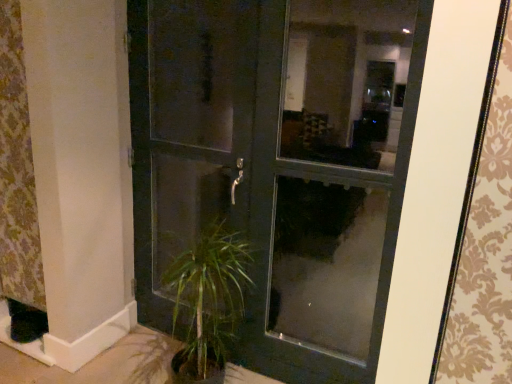
This screenshot has width=512, height=384. Identify the location of matte black screen door at center. (188, 130).

Considering the relative positions of patterned fabric curtain at left and matte black screen door at center in the image provided, is patterned fabric curtain at left in front of matte black screen door at center?

No, patterned fabric curtain at left is further to the viewer.

Is matte black screen door at center at the back of patterned fabric curtain at left?

No.

Which of these two, patterned fabric curtain at left or matte black screen door at center, is smaller?

patterned fabric curtain at left.

Which of these two, matte black screen door at center or patterned fabric curtain at left, is smaller?

patterned fabric curtain at left is smaller.

Is matte black screen door at center not within patterned fabric curtain at left?

matte black screen door at center lies outside patterned fabric curtain at left's area.

Looking at this image, does matte black screen door at center appear on the left side of patterned fabric curtain at left?

Incorrect, matte black screen door at center is not on the left side of patterned fabric curtain at left.

Considering the sizes of objects patterned fabric curtain at left and matte black door at center in the image provided, who is wider, patterned fabric curtain at left or matte black door at center?

matte black door at center is wider.

Considering the sizes of objects patterned fabric curtain at left and matte black door at center in the image provided, who is bigger, patterned fabric curtain at left or matte black door at center?

Bigger between the two is matte black door at center.

I want to click on curtain that is above the matte black door at center (from a real-world perspective), so click(x=17, y=171).

Is point (20, 43) closer or farther from the camera than point (302, 143)?

Point (20, 43) is positioned farther from the camera compared to point (302, 143).

Between matte black door at center and patterned fabric curtain at left, which one appears on the right side from the viewer's perspective?

Positioned to the right is matte black door at center.

From the image's perspective, is matte black door at center located above or below patterned fabric curtain at left?

Clearly, from the image's perspective, matte black door at center is below patterned fabric curtain at left.

From a real-world perspective, is matte black door at center located beneath patterned fabric curtain at left?

Yes.

Can you confirm if matte black door at center is thinner than patterned fabric curtain at left?

No, matte black door at center is not thinner than patterned fabric curtain at left.

Is matte black door at center further to camera compared to matte black screen door at center?

That is False.

In the scene shown: Between matte black door at center and matte black screen door at center, which one appears on the left side from the viewer's perspective?

matte black screen door at center.

Looking at this image, from a real-world perspective, is matte black door at center located higher than matte black screen door at center?

Incorrect, from a real-world perspective, matte black door at center is lower than matte black screen door at center.

Does matte black door at center have a smaller size compared to matte black screen door at center?

Actually, matte black door at center might be larger than matte black screen door at center.

Is matte black screen door at center in contact with matte black door at center?

No, matte black screen door at center is not making contact with matte black door at center.

Looking at this image, which is in front, matte black screen door at center or matte black door at center?

matte black door at center is in front.

From a real-world perspective, between matte black screen door at center and matte black door at center, who is vertically higher?

In real-world perspective, matte black screen door at center is above.

How many degrees apart are the facing directions of matte black screen door at center and matte black door at center?

matte black screen door at center and matte black door at center are facing 0.00774 degrees away from each other.

This screenshot has width=512, height=384. Find the location of `screen door located underneath the patterned fabric curtain at left (from a real-world perspective)`. screen door located underneath the patterned fabric curtain at left (from a real-world perspective) is located at coordinates (188, 130).

Find the location of `screen door lying in front of the patterned fabric curtain at left`. screen door lying in front of the patterned fabric curtain at left is located at coordinates click(x=188, y=130).

Estimate the real-world distances between objects in this image. Which object is closer to matte black screen door at center, patterned fabric curtain at left or matte black door at center?

matte black door at center is closer to matte black screen door at center.

From the image, which object appears to be farther from patterned fabric curtain at left, matte black door at center or matte black screen door at center?

Based on the image, matte black door at center appears to be further to patterned fabric curtain at left.

From the picture: Which object lies further to the anchor point matte black door at center, patterned fabric curtain at left or matte black screen door at center?

The object further to matte black door at center is patterned fabric curtain at left.

Based on the photo, when comparing their distances from patterned fabric curtain at left, does matte black screen door at center or matte black door at center seem further?

Based on the image, matte black door at center appears to be further to patterned fabric curtain at left.

Looking at the image, which one is located closer to matte black screen door at center, matte black door at center or patterned fabric curtain at left?

matte black door at center lies closer to matte black screen door at center than the other object.

Looking at this image, estimate the real-world distances between objects in this image. Which object is further from matte black door at center, matte black screen door at center or patterned fabric curtain at left?

patterned fabric curtain at left is positioned further to the anchor matte black door at center.

You are a GUI agent. You are given a task and a screenshot of the screen. Output one action in this format:
    pyautogui.click(x=<x>, y=<y>)
    Task: Click on the screen door located between patterned fabric curtain at left and matte black door at center in the left-right direction
    This screenshot has height=384, width=512.
    Given the screenshot: What is the action you would take?
    pyautogui.click(x=188, y=130)